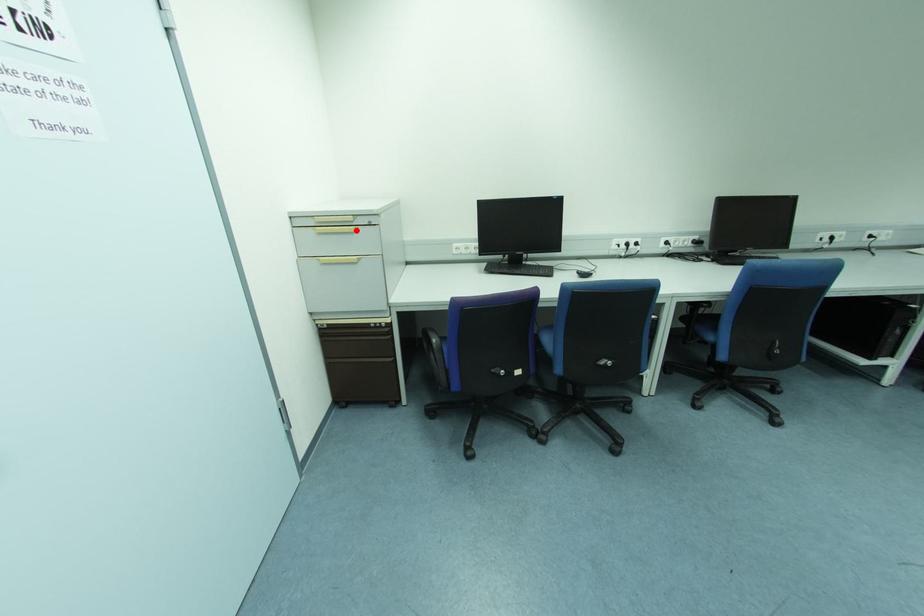
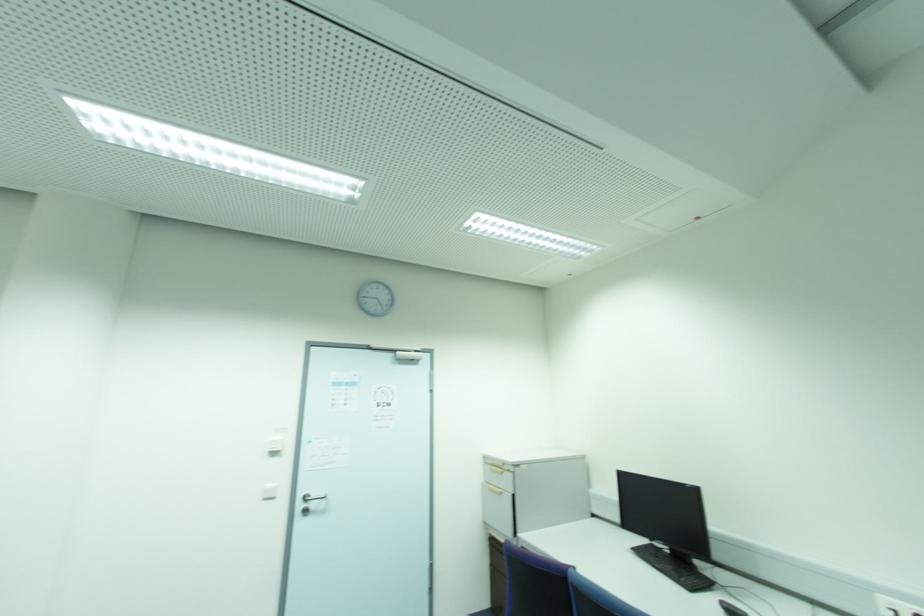
Locate, in the second image, the point that corresponds to the highlighted location in the first image.

(503, 472)